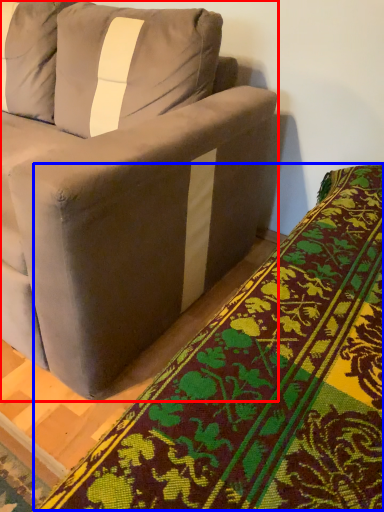
Question: Which object appears closest to the camera in this image, studio couch (highlighted by a red box) or blanket (highlighted by a blue box)?

Choices:
 (A) studio couch
 (B) blanket

Answer: (B)